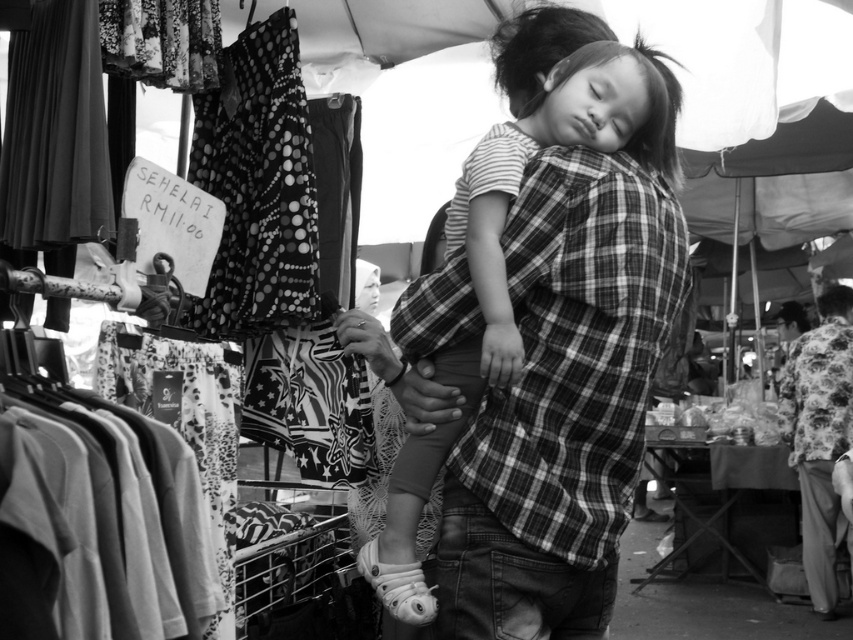
You are a photographer who just took a photo of a market scene. In the image, there are two points marked as point 1 at coordinates (637, 218) and point 2 at (827, 326). You want to adjust your focus to ensure both points are in focus. Which point should you focus on first to achieve this?

You should focus on point 1 at coordinates (637, 218) first because it is closer to the viewer than point 2 at (827, 326). This way, the depth of field will extend from the closer point to the farther one, potentially keeping both in focus.